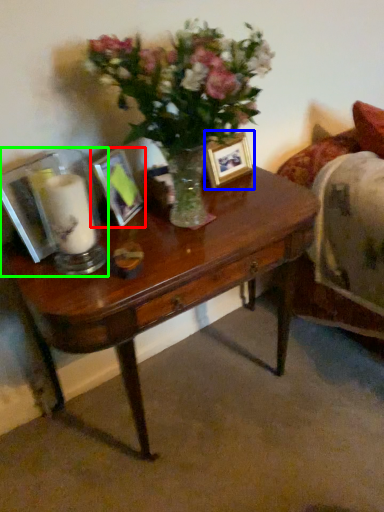
Question: Considering the real-world distances, which object is closest to picture frame (highlighted by a red box)? picture frame (highlighted by a blue box) or tableware (highlighted by a green box).

Choices:
 (A) picture frame
 (B) tableware

Answer: (B)